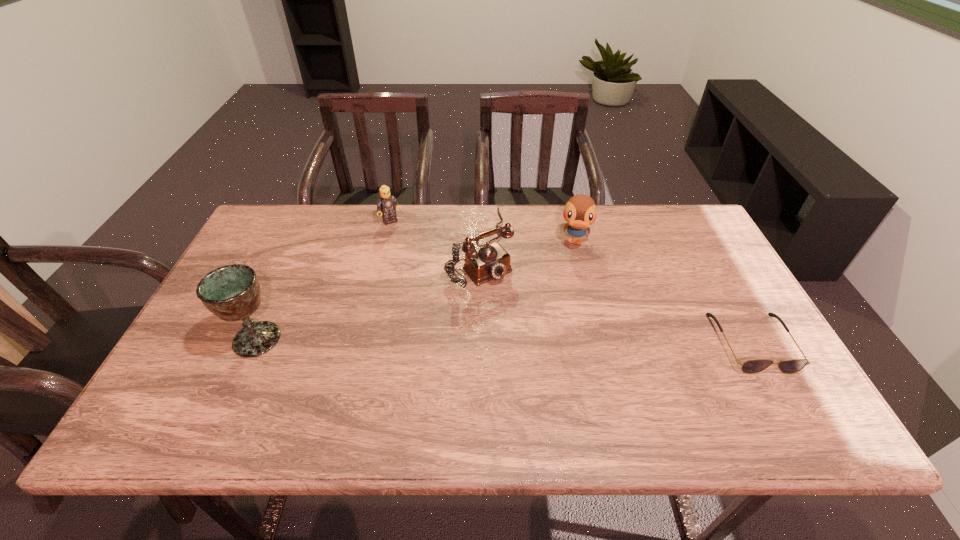
Identify the location of object located at the near edge. (753, 366).

Locate an element on the screen. Image resolution: width=960 pixels, height=540 pixels. object at the left edge is located at coordinates (232, 292).

In order to click on object that is at the right edge in this screenshot , I will do `click(753, 366)`.

Locate an element on the screen. object present at the near right corner is located at coordinates (753, 366).

You are a GUI agent. You are given a task and a screenshot of the screen. Output one action in this format:
    pyautogui.click(x=<x>, y=<y>)
    Task: Click on the vacant space at the far edge
    
    Given the screenshot: What is the action you would take?
    pyautogui.click(x=588, y=242)

Identify the location of vacant area at the near edge of the desktop. Image resolution: width=960 pixels, height=540 pixels. (426, 375).

In the image, there is a desktop. Find the location of `vacant space at the right edge`. vacant space at the right edge is located at coordinates (777, 359).

In the image, there is a desktop. Identify the location of vacant space at the far left corner. (268, 238).

Identify the location of vacant space at the near right corner of the desktop. The height and width of the screenshot is (540, 960). (766, 372).

Where is `vacant space that's between the chalice and the third object from left to right`? This screenshot has height=540, width=960. vacant space that's between the chalice and the third object from left to right is located at coordinates (368, 293).